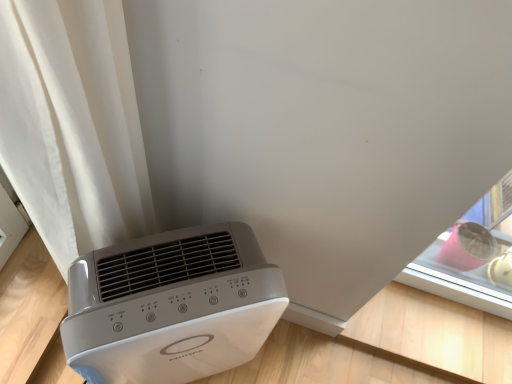
Where is `white glossy air purifier at lower left`? This screenshot has width=512, height=384. white glossy air purifier at lower left is located at coordinates (170, 306).

This screenshot has height=384, width=512. What do you see at coordinates (170, 306) in the screenshot? I see `white glossy air purifier at lower left` at bounding box center [170, 306].

Where is `white glossy air purifier at lower left`? This screenshot has width=512, height=384. white glossy air purifier at lower left is located at coordinates (170, 306).